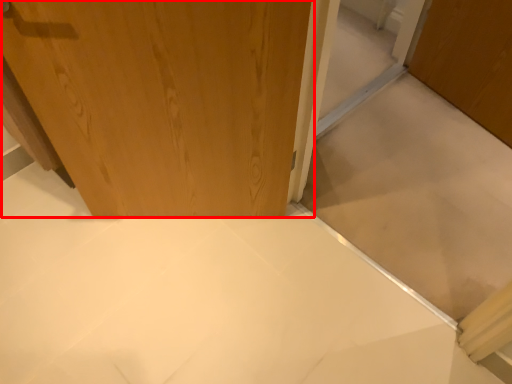
Question: In this image, where is door (annotated by the red box) located relative to cabinetry?

Choices:
 (A) left
 (B) right

Answer: (A)